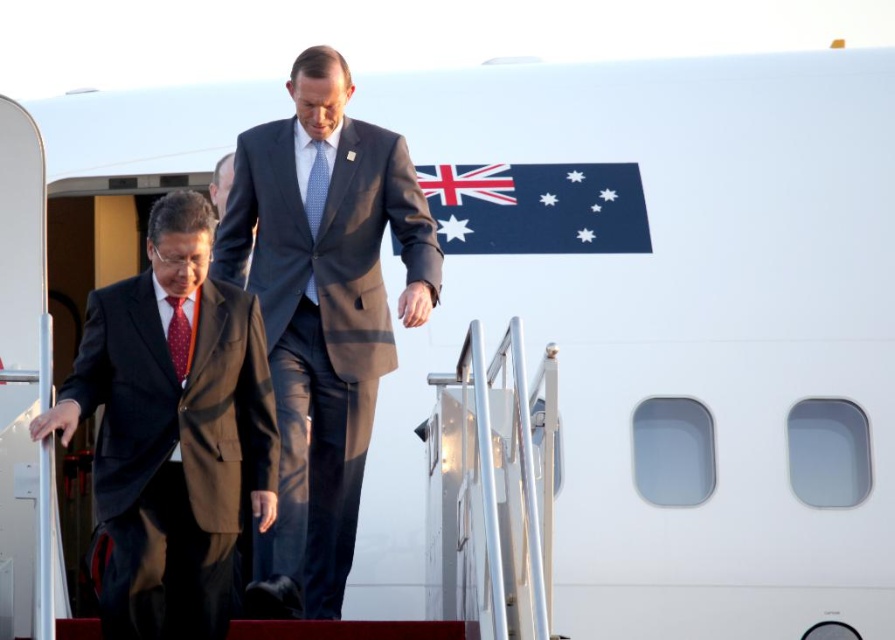
You are a photographer positioned at the origin point of the scene. You need to capture a photo of the matte black suit at left. According to the coordinates provided, where should you aim your camera to ensure the suit is centered in the frame?

The matte black suit at left is located at point [172,433], so you should aim your camera at those coordinates to center it in the frame.

You are an airport security officer checking the scene. You notice a point marked at coordinates (x=172, y=433). What object is located at that point?

The point at coordinates (x=172, y=433) marks the matte black suit at left.

You are an airport security officer checking the passengers. You notice two items at the center of your monitor, a dark blue suit at center and a blue dotted fabric tie at center. Which item is located to the right of the other?

The dark blue suit at center is positioned on the right side of blue dotted fabric tie at center.